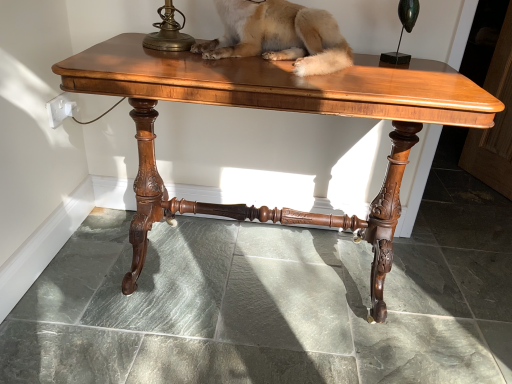
Question: Considering their positions, is shiny brown wood table at center located in front of or behind fuzzy beige dog at center?

Choices:
 (A) front
 (B) behind

Answer: (A)

Question: Is shiny brown wood table at center inside or outside of fuzzy beige dog at center?

Choices:
 (A) outside
 (B) inside

Answer: (A)

Question: Considering the real-world distances, which object is farthest from the green polished glass candle holder at upper right?

Choices:
 (A) fuzzy beige dog at center
 (B) shiny brown wood table at center

Answer: (B)

Question: Which object is positioned farthest from the fuzzy beige dog at center?

Choices:
 (A) green polished glass candle holder at upper right
 (B) shiny brown wood table at center

Answer: (A)